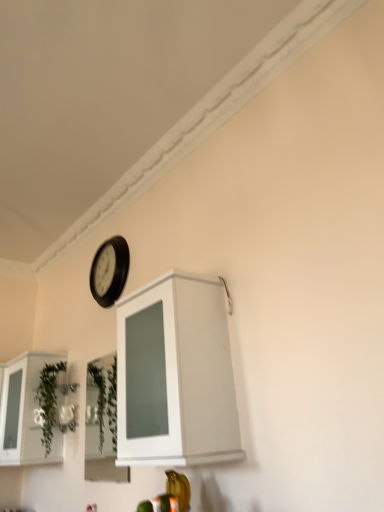
Question: Can you confirm if green leafy plant at lower left is thinner than black plastic clock at upper center?

Choices:
 (A) yes
 (B) no

Answer: (B)

Question: From the image's perspective, is green leafy plant at lower left located above black plastic clock at upper center?

Choices:
 (A) no
 (B) yes

Answer: (A)

Question: Does green leafy plant at lower left have a greater height compared to black plastic clock at upper center?

Choices:
 (A) no
 (B) yes

Answer: (B)

Question: Considering the relative positions of green leafy plant at lower left and black plastic clock at upper center in the image provided, is green leafy plant at lower left to the left of black plastic clock at upper center from the viewer's perspective?

Choices:
 (A) yes
 (B) no

Answer: (A)

Question: Is green leafy plant at lower left outside black plastic clock at upper center?

Choices:
 (A) yes
 (B) no

Answer: (A)

Question: From the image's perspective, is green leafy plant at lower left under black plastic clock at upper center?

Choices:
 (A) no
 (B) yes

Answer: (B)

Question: Considering the relative positions of white glossy cabinet at upper center, acting as the first cabinetry starting from the front, and green leafy plant at lower left in the image provided, is white glossy cabinet at upper center, acting as the first cabinetry starting from the front, to the right of green leafy plant at lower left from the viewer's perspective?

Choices:
 (A) no
 (B) yes

Answer: (B)

Question: Can you confirm if white glossy cabinet at upper center, acting as the first cabinetry starting from the front, is shorter than green leafy plant at lower left?

Choices:
 (A) no
 (B) yes

Answer: (A)

Question: Considering the relative positions of white glossy cabinet at upper center, acting as the first cabinetry starting from the front, and green leafy plant at lower left in the image provided, is white glossy cabinet at upper center, acting as the first cabinetry starting from the front, in front of green leafy plant at lower left?

Choices:
 (A) no
 (B) yes

Answer: (B)

Question: From a real-world perspective, is white glossy cabinet at upper center, which is counted as the 1th cabinetry, starting from the right, below green leafy plant at lower left?

Choices:
 (A) yes
 (B) no

Answer: (A)

Question: Is white glossy cabinet at upper center, acting as the first cabinetry starting from the front, turned away from green leafy plant at lower left?

Choices:
 (A) yes
 (B) no

Answer: (B)

Question: From the image's perspective, is white glossy cabinet at upper center, the second cabinetry in the left-to-right sequence, below green leafy plant at lower left?

Choices:
 (A) no
 (B) yes

Answer: (A)

Question: From the image's perspective, is black plastic clock at upper center located beneath white glossy cabinet at upper center, the second cabinetry in the left-to-right sequence?

Choices:
 (A) no
 (B) yes

Answer: (A)